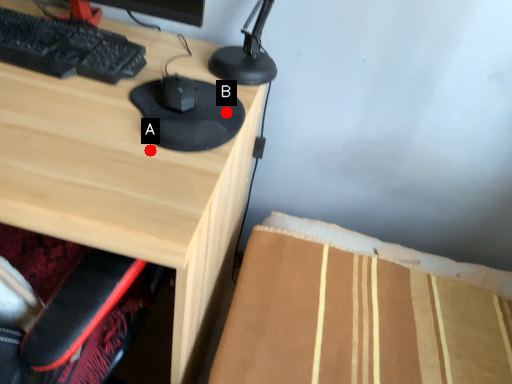
Question: Two points are circled on the image, labeled by A and B beside each circle. Which point appears farthest from the camera in this image?

Choices:
 (A) A is further
 (B) B is further

Answer: (B)